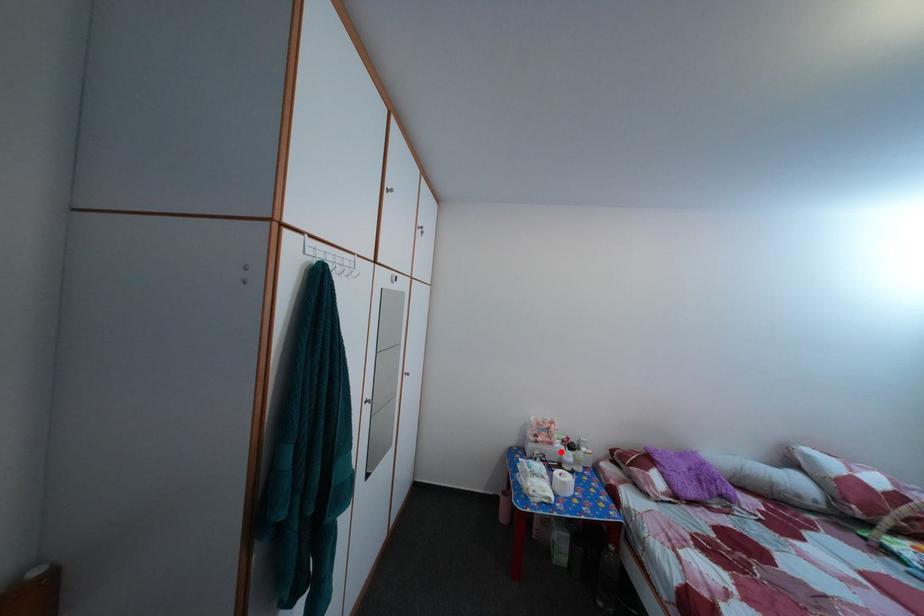
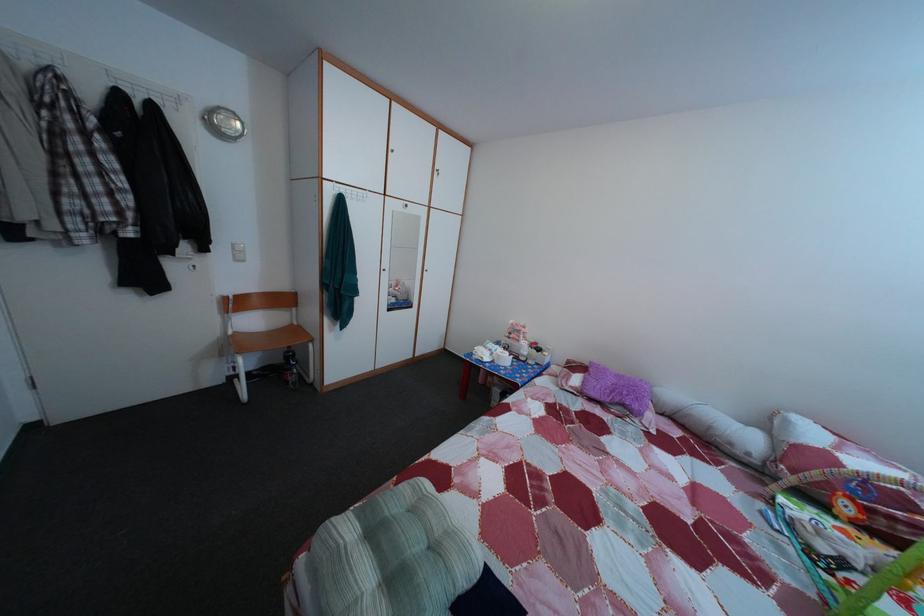
Question: I am providing you with two images of the same scene from different viewpoints. Given a red point in image1, look at the same physical point in image2. Is it:

Choices:
 (A) Closer to the viewpoint
 (B) Farther from the viewpoint

Answer: (A)